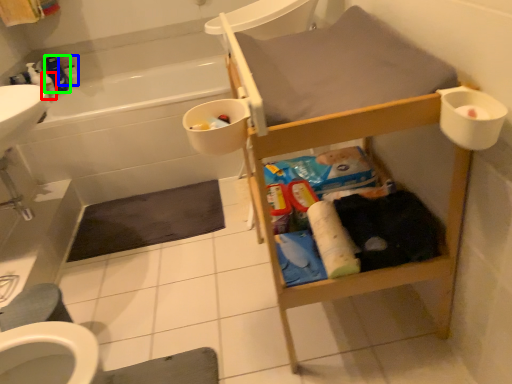
Question: Which object is positioned farthest from toiletry (highlighted by a red box)? Select from toiletry (highlighted by a blue box) and cleaning product (highlighted by a green box).

Choices:
 (A) toiletry
 (B) cleaning product

Answer: (A)